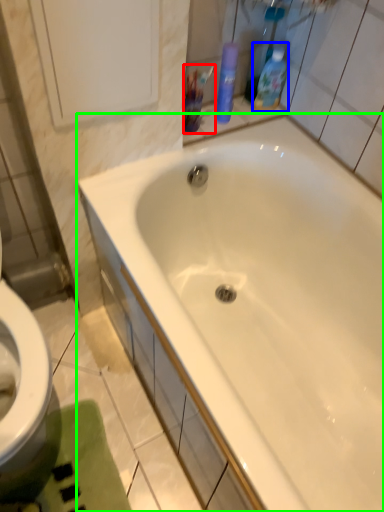
Question: Considering the real-world distances, which object is closest to mouthwash (highlighted by a red box)? cleaning product (highlighted by a blue box) or bathtub (highlighted by a green box).

Choices:
 (A) cleaning product
 (B) bathtub

Answer: (A)